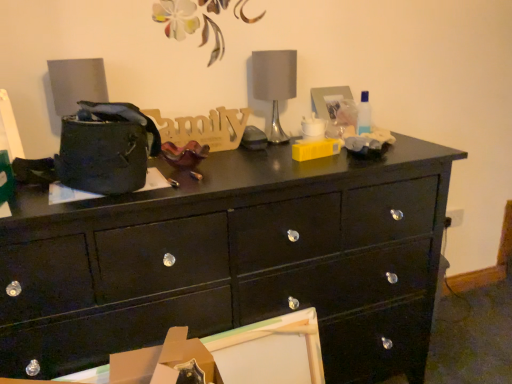
Question: Is black glossy chest of drawers at center wider than glossy black drawer at lower left?

Choices:
 (A) yes
 (B) no

Answer: (A)

Question: Is black glossy chest of drawers at center outside of glossy black drawer at lower left?

Choices:
 (A) yes
 (B) no

Answer: (A)

Question: Considering the relative sizes of black glossy chest of drawers at center and glossy black drawer at lower left in the image provided, is black glossy chest of drawers at center thinner than glossy black drawer at lower left?

Choices:
 (A) yes
 (B) no

Answer: (B)

Question: Does black glossy chest of drawers at center lie in front of glossy black drawer at lower left?

Choices:
 (A) no
 (B) yes

Answer: (A)

Question: From the image's perspective, is black glossy chest of drawers at center located above glossy black drawer at lower left?

Choices:
 (A) no
 (B) yes

Answer: (B)

Question: In terms of width, does black glossy chest of drawers at center look wider or thinner when compared to satin silver table lamp at center?

Choices:
 (A) thin
 (B) wide

Answer: (B)

Question: Is point (9, 264) positioned closer to the camera than point (269, 91)?

Choices:
 (A) closer
 (B) farther

Answer: (A)

Question: In the image, is black glossy chest of drawers at center positioned in front of or behind satin silver table lamp at center?

Choices:
 (A) behind
 (B) front

Answer: (B)

Question: From the image's perspective, relative to satin silver table lamp at center, is black glossy chest of drawers at center above or below?

Choices:
 (A) above
 (B) below

Answer: (B)

Question: Does point (136, 375) appear closer or farther from the camera than point (267, 69)?

Choices:
 (A) closer
 (B) farther

Answer: (A)

Question: Based on their sizes in the image, would you say cardboard box at lower center is bigger or smaller than satin silver table lamp at center?

Choices:
 (A) big
 (B) small

Answer: (B)

Question: In the image, is cardboard box at lower center positioned in front of or behind satin silver table lamp at center?

Choices:
 (A) behind
 (B) front

Answer: (B)

Question: Considering the relative positions of cardboard box at lower center and satin silver table lamp at center in the image provided, is cardboard box at lower center to the left or to the right of satin silver table lamp at center?

Choices:
 (A) right
 (B) left

Answer: (B)

Question: In the image, is satin silver table lamp at center positioned in front of or behind glossy black drawer at lower left?

Choices:
 (A) behind
 (B) front

Answer: (A)

Question: From a real-world perspective, is satin silver table lamp at center physically located above or below glossy black drawer at lower left?

Choices:
 (A) below
 (B) above

Answer: (B)